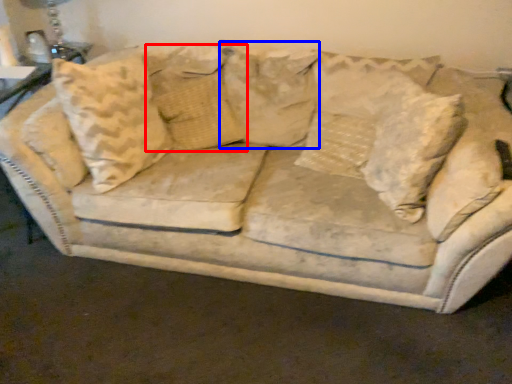
Question: Which object is closer to the camera taking this photo, pillow (highlighted by a red box) or pillow (highlighted by a blue box)?

Choices:
 (A) pillow
 (B) pillow

Answer: (B)